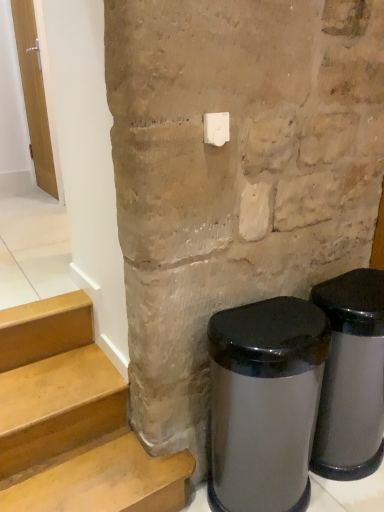
Question: Is satin silver trash can at lower right, which is counted as the 1th waste container, starting from the left, in front of or behind satin silver trash can at lower right, the second waste container from the left, in the image?

Choices:
 (A) front
 (B) behind

Answer: (A)

Question: Considering the positions of satin silver trash can at lower right, which is counted as the 1th waste container, starting from the left, and satin silver trash can at lower right, the second waste container from the left, in the image, is satin silver trash can at lower right, which is counted as the 1th waste container, starting from the left, taller or shorter than satin silver trash can at lower right, the second waste container from the left,?

Choices:
 (A) short
 (B) tall

Answer: (A)

Question: Estimate the real-world distances between objects in this image. Which object is closer to the satin silver trash can at lower right, the second waste container from the left?

Choices:
 (A) white plastic light switch at upper center
 (B) wooden door at left
 (C) satin silver trash can at lower right, acting as the second waste container starting from the right

Answer: (C)

Question: Estimate the real-world distances between objects in this image. Which object is farther from the satin silver trash can at lower right, the second waste container from the left?

Choices:
 (A) wooden door at left
 (B) satin silver trash can at lower right, acting as the second waste container starting from the right
 (C) white plastic light switch at upper center

Answer: (A)